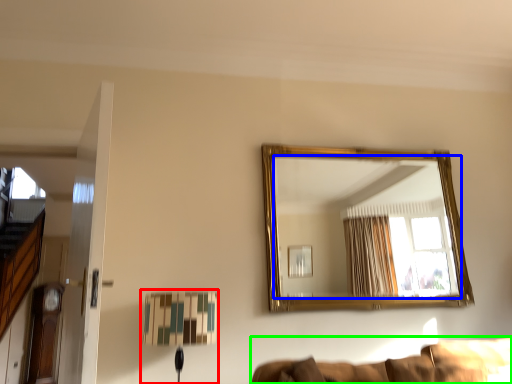
Question: Considering the real-world distances, which object is farthest from table lamp (highlighted by a red box)? mirror (highlighted by a blue box) or couch (highlighted by a green box)?

Choices:
 (A) mirror
 (B) couch

Answer: (A)